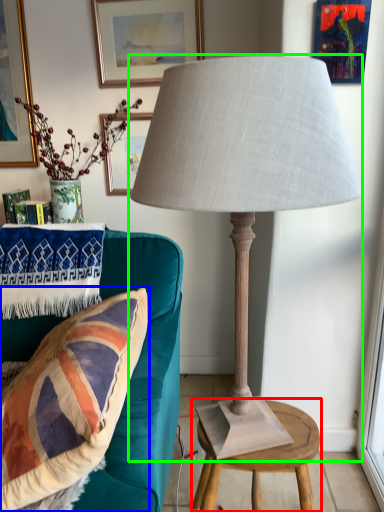
Question: Estimate the real-world distances between objects in this image. Which object is farther from table (highlighted by a red box), pillow (highlighted by a blue box) or lamp (highlighted by a green box)?

Choices:
 (A) pillow
 (B) lamp

Answer: (B)